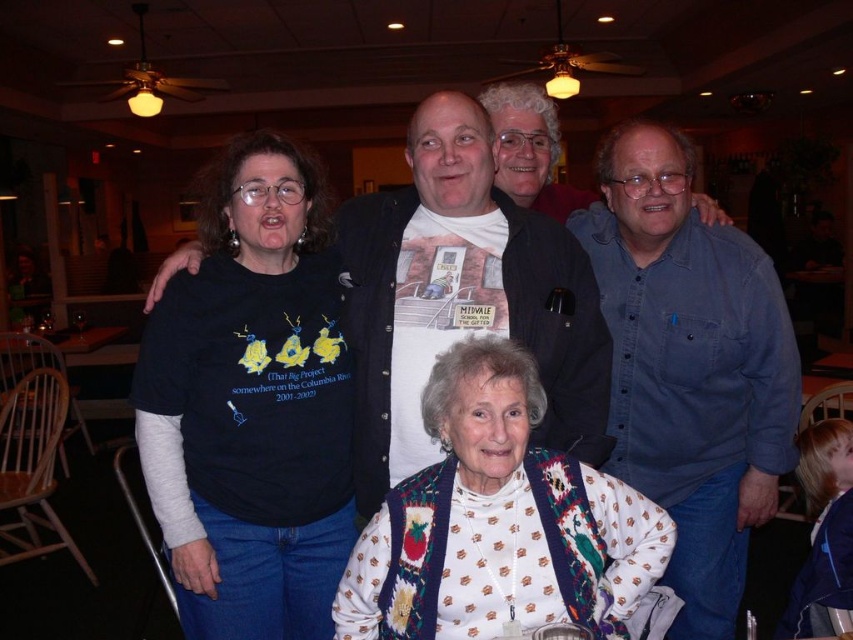
Is point (219, 518) positioned behind point (740, 232)?

No.

Between black t-shirt at left and blue denim shirt at upper right, which one appears on the left side from the viewer's perspective?

black t-shirt at left

Is point (276, 257) positioned in front of point (677, 156)?

Yes.

Locate an element on the screen. This screenshot has height=640, width=853. black t-shirt at left is located at coordinates (251, 404).

Is blue denim shirt at upper right positioned behind white knitted sweater at center?

Yes, blue denim shirt at upper right is further from the viewer.

Between point (723, 381) and point (492, 346), which one is positioned in front?

Point (492, 346)

Who is more forward, (704,360) or (375,596)?

Point (375,596) is in front.

Locate an element on the screen. This screenshot has height=640, width=853. blue denim shirt at upper right is located at coordinates (689, 365).

Is black t-shirt at left behind white knitted sweater at center?

Yes, it is.

Which is in front, point (247, 189) or point (598, 509)?

Point (598, 509) is in front.

Find the location of a particular element. Image resolution: width=853 pixels, height=640 pixels. black t-shirt at left is located at coordinates (251, 404).